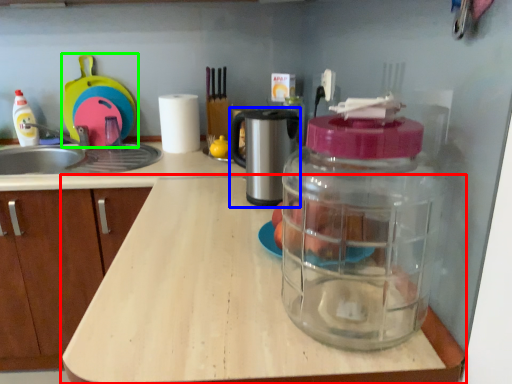
Question: Considering the real-world distances, which object is farthest from countertop (highlighted by a red box)? coffee machine (highlighted by a blue box) or appliance (highlighted by a green box)?

Choices:
 (A) coffee machine
 (B) appliance

Answer: (B)